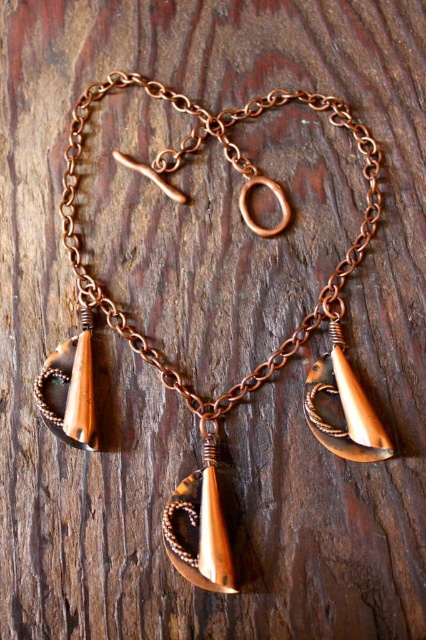
Question: Can you confirm if copper wire wrapped pendant at center is thinner than matte copper pendant at lower right?

Choices:
 (A) no
 (B) yes

Answer: (A)

Question: Which point is farther from the camera taking this photo?

Choices:
 (A) (353, 460)
 (B) (92, 392)

Answer: (B)

Question: Is copper wire wrapped pendant at center above matte copper pendant at lower right?

Choices:
 (A) no
 (B) yes

Answer: (B)

Question: Which point is farther from the camera taking this photo?

Choices:
 (A) (359, 387)
 (B) (213, 442)

Answer: (A)

Question: Among these points, which one is farthest from the camera?

Choices:
 (A) (347, 385)
 (B) (204, 452)

Answer: (A)

Question: Is copper wire wrapped pendant at center to the left of matte copper pendant at lower right from the viewer's perspective?

Choices:
 (A) yes
 (B) no

Answer: (A)